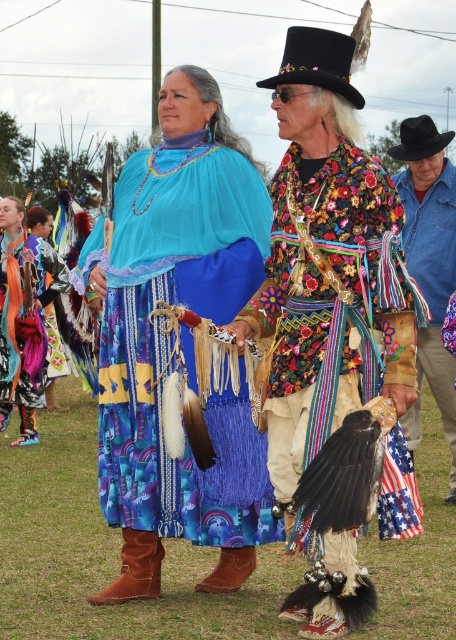
Question: Does blue fabric dress at center have a smaller size compared to blue fabric skirt at center?

Choices:
 (A) no
 (B) yes

Answer: (A)

Question: Estimate the real-world distances between objects in this image. Which object is farther from the blue fabric dress at center?

Choices:
 (A) blue fabric skirt at center
 (B) blue denim shirt at center
 (C) shiny metallic headdress at upper center
 (D) blue woven skirt at center

Answer: (A)

Question: Does blue fabric dress at center have a larger size compared to shiny metallic headdress at upper center?

Choices:
 (A) no
 (B) yes

Answer: (B)

Question: Which of the following is the farthest from the observer?

Choices:
 (A) (315, 451)
 (B) (36, 330)
 (C) (234, 477)

Answer: (B)

Question: Is blue denim shirt at center thinner than shiny metallic headdress at upper center?

Choices:
 (A) no
 (B) yes

Answer: (A)

Question: Based on their relative distances, which object is farther from the blue fabric skirt at center?

Choices:
 (A) blue woven skirt at center
 (B) shiny metallic headdress at upper center
 (C) blue fabric dress at center
 (D) blue denim shirt at center

Answer: (C)